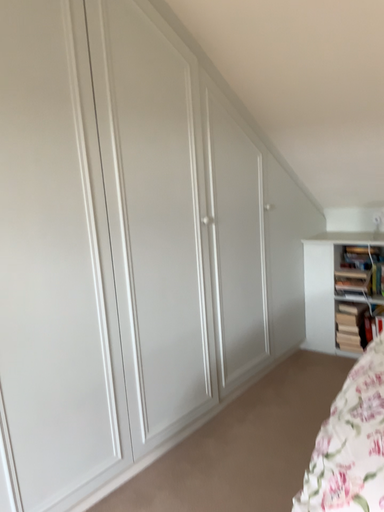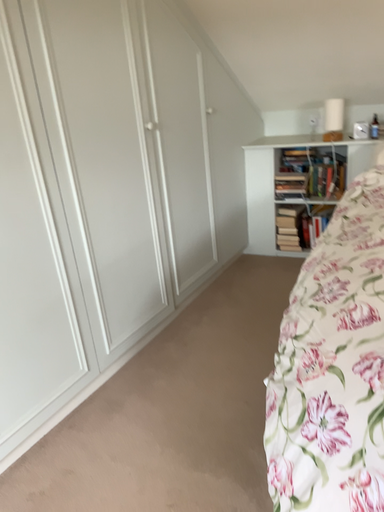
Question: How did the camera likely rotate when shooting the video?

Choices:
 (A) rotated right
 (B) rotated left

Answer: (A)